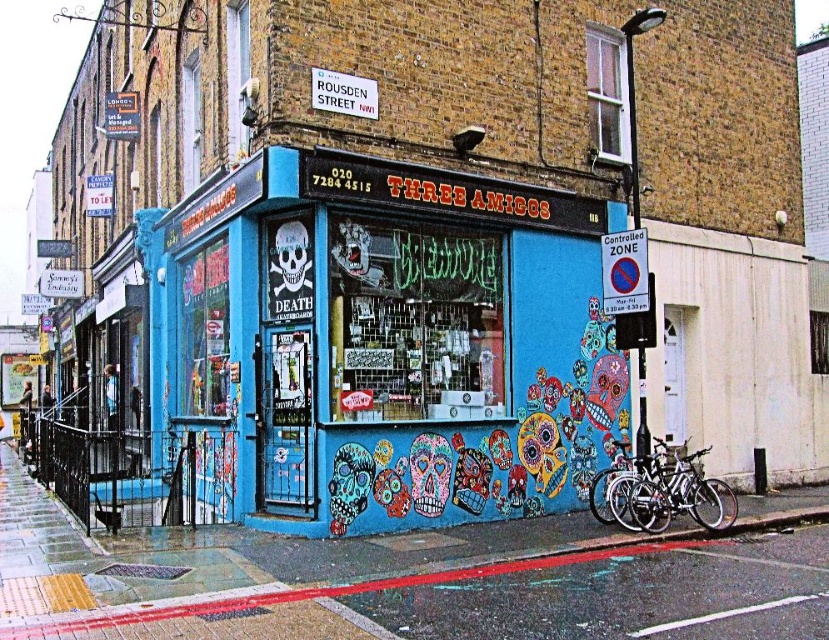
You are a mural artist planning to paint a new design on the blue painted wall at center and the silver metallic bicycle at lower right. Which object requires a larger amount of paint due to its size?

The silver metallic bicycle at lower right requires more paint because it is larger than the blue painted wall at center according to the description.

You are a delivery person trying to park your motorcycle in front of the Three Amigos shop. You see the blue painted wall at center and the silver metallic bicycle at lower right. Which object is closer to the entrance of the shop?

The blue painted wall at center is to the left of the silver metallic bicycle at lower right, so the blue painted wall at center is closer to the entrance of the shop.

You are a customer standing in front of the Three Amigos shop. You see a silver metallic bicycle at lower right and a matte black skull at center. Which object is positioned to the right side of the other?

→ The silver metallic bicycle at lower right is positioned to the right of the matte black skull at center.